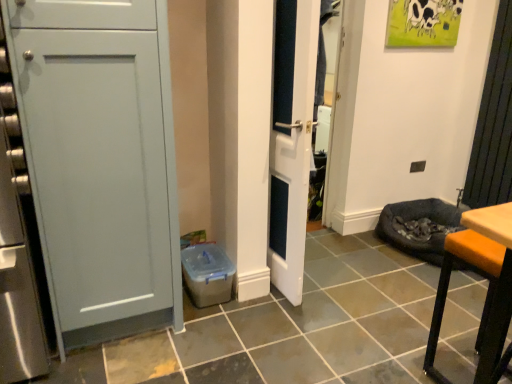
The image size is (512, 384). I want to click on vacant space to the right of white glossy door at center, so click(x=333, y=290).